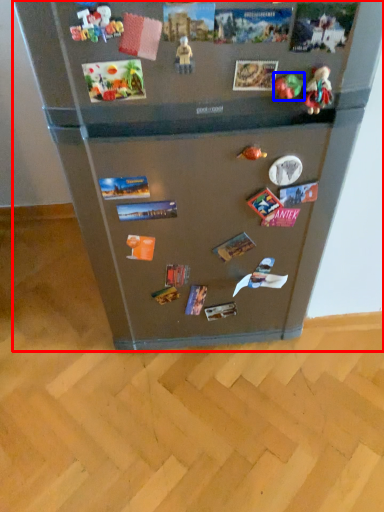
Question: Among these objects, which one is farthest to the camera, refrigerator (highlighted by a red box) or toy (highlighted by a blue box)?

Choices:
 (A) refrigerator
 (B) toy

Answer: (B)